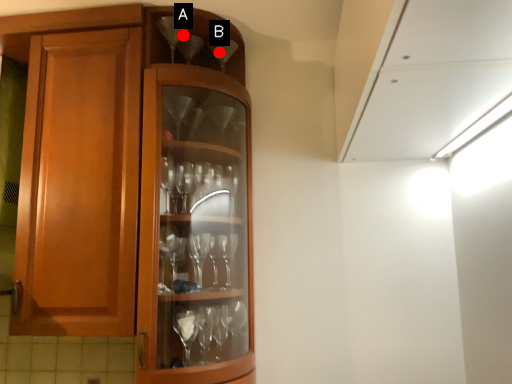
Question: Two points are circled on the image, labeled by A and B beside each circle. Which of the following is the closest to the observer?

Choices:
 (A) A is closer
 (B) B is closer

Answer: (A)